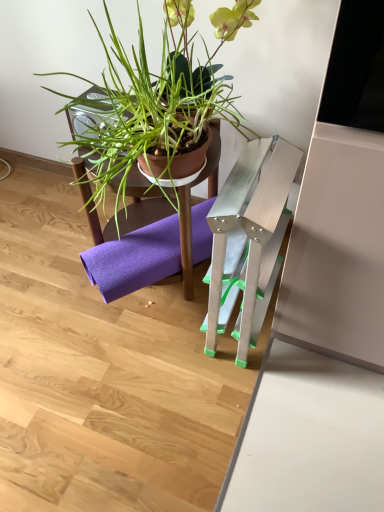
Question: Is matte brown pot at center taller or shorter than purple fabric yoga mat at lower center?

Choices:
 (A) short
 (B) tall

Answer: (B)

Question: Is matte brown pot at center in front of or behind purple fabric yoga mat at lower center in the image?

Choices:
 (A) front
 (B) behind

Answer: (A)

Question: Based on their relative distances, which object is farther from the brown matte plant pot at upper center?

Choices:
 (A) purple fabric yoga mat at lower center
 (B) matte brown pot at center

Answer: (B)

Question: Considering the real-world distances, which object is farthest from the brown matte plant pot at upper center?

Choices:
 (A) matte brown pot at center
 (B) purple fabric yoga mat at lower center

Answer: (A)